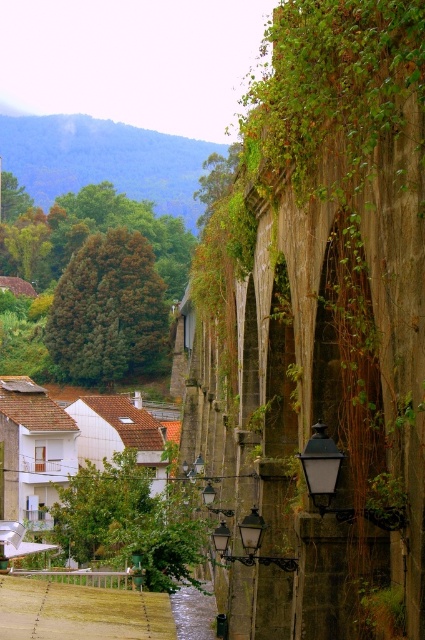
You are a photographer standing in front of the historic aqueduct wall. You want to take a photo that includes both the point at coordinates point [93,326] and point [104,445]. Which point should you focus on first to ensure both are in focus?

You should focus on point [93,326] first because it is closer to the camera than point [104,445]. This ensures that both points will be in focus when using a suitable aperture setting.

You are an artist planning to paint the scene. You want to focus on the green leafy ivy at center and the white matte house at lower left. Which object should you paint first if you follow the rule of painting larger objects before smaller ones?

The green leafy ivy at center should be painted first because it is bigger than the white matte house at lower left.